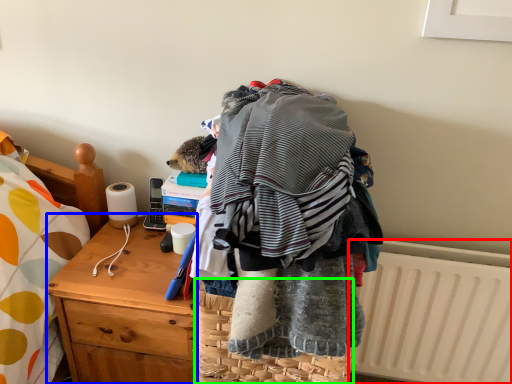
Question: Based on their relative distances, which object is nearer to radiator (highlighted by a red box)? Choose from desk (highlighted by a blue box) and picnic basket (highlighted by a green box).

Choices:
 (A) desk
 (B) picnic basket

Answer: (B)